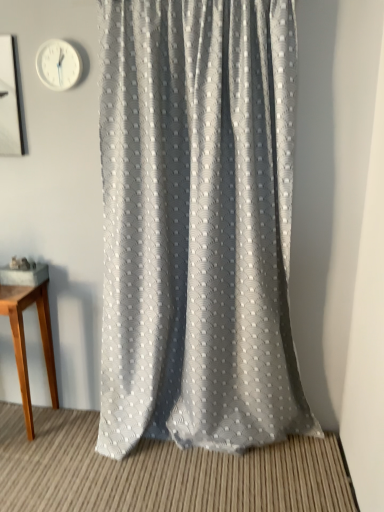
Question: Based on their sizes in the image, would you say light brown wooden table at left is bigger or smaller than white plastic clock at upper left?

Choices:
 (A) big
 (B) small

Answer: (A)

Question: Is point (39, 308) closer or farther from the camera than point (56, 86)?

Choices:
 (A) closer
 (B) farther

Answer: (B)

Question: Estimate the real-world distances between objects in this image. Which object is farther from the white plastic clock at upper left?

Choices:
 (A) textured gray curtain at center
 (B) light brown wooden table at left

Answer: (B)

Question: Estimate the real-world distances between objects in this image. Which object is closer to the light brown wooden table at left?

Choices:
 (A) white plastic clock at upper left
 (B) textured gray curtain at center

Answer: (B)